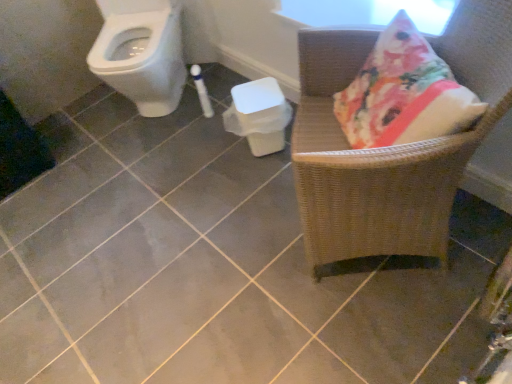
Image resolution: width=512 pixels, height=384 pixels. I want to click on vacant region to the left of white glossy toilet at upper left, so click(x=86, y=125).